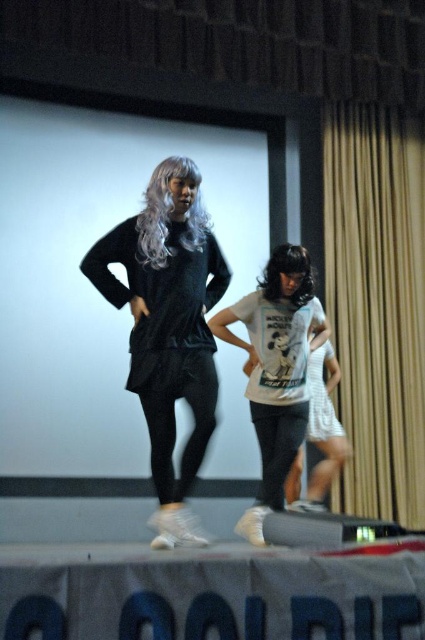
Based on the coordinates provided, which object is located at point (167, 326)?

The point (167, 326) corresponds to the location of the matte black dress at center.

You are standing on the stage and want to exit through the nearest curtain. The stage has a matte gold curtain at right. Where should you go to exit?

The matte gold curtain at right is located at point (377, 304), so you should go to the right side of the stage where the matte gold curtain at right is positioned to exit.